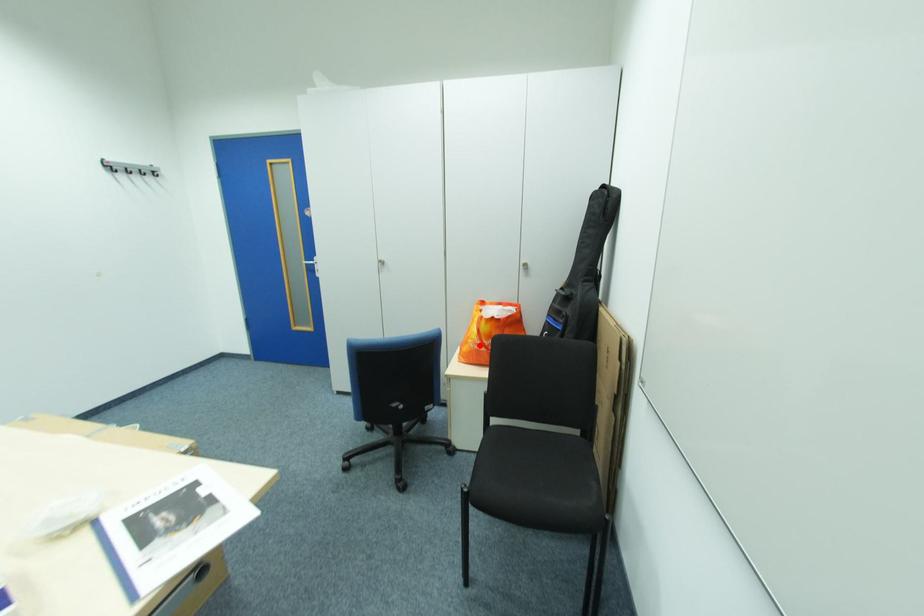
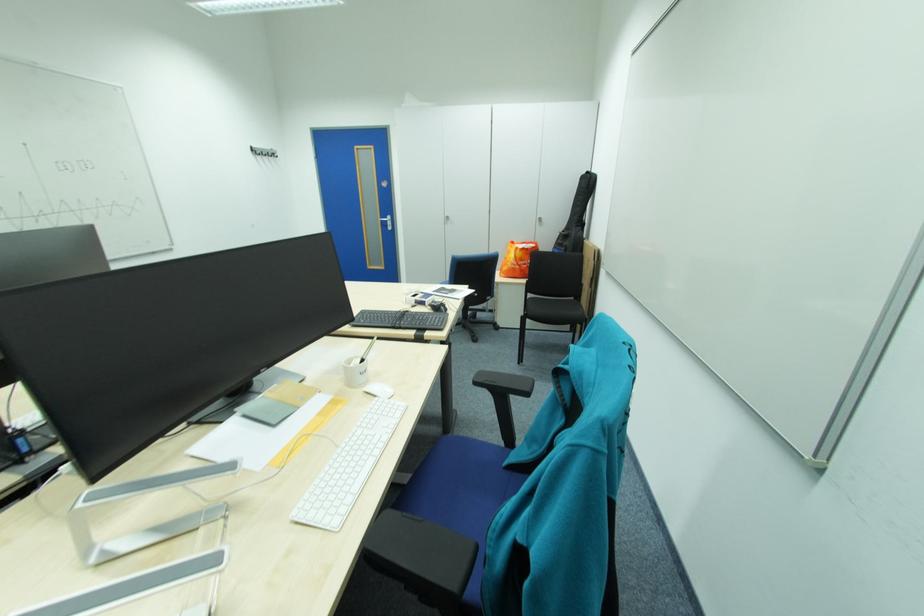
Question: I am providing you with two images of the same scene from different viewpoints. Given a red point in image1, look at the same physical point in image2. Is it:

Choices:
 (A) Closer to the viewpoint
 (B) Farther from the viewpoint

Answer: (A)